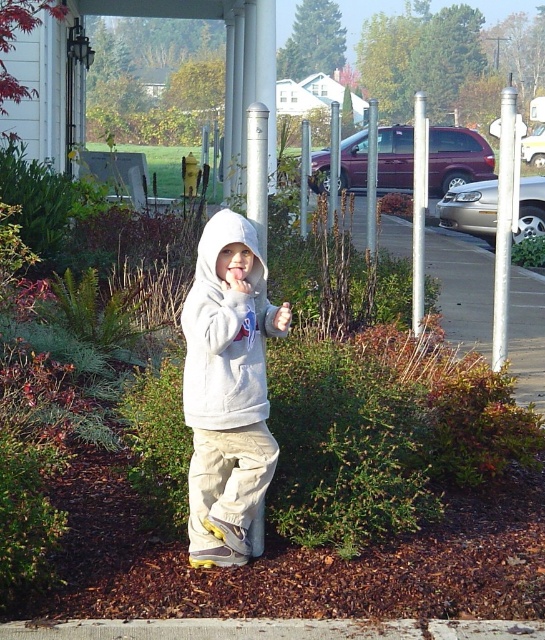
You are a tailor measuring the width of the light gray hoodie at center and the white plastic pole at center. Which object has a smaller width?

The light gray hoodie at center has a smaller width than the white plastic pole at center.

You are a photographer trying to capture the light gray hoodie at center in your shot. What are the exact coordinates where you should focus your camera?

The light gray hoodie at center is located at the 2D coordinates point (227, 388), so you should focus your camera there.